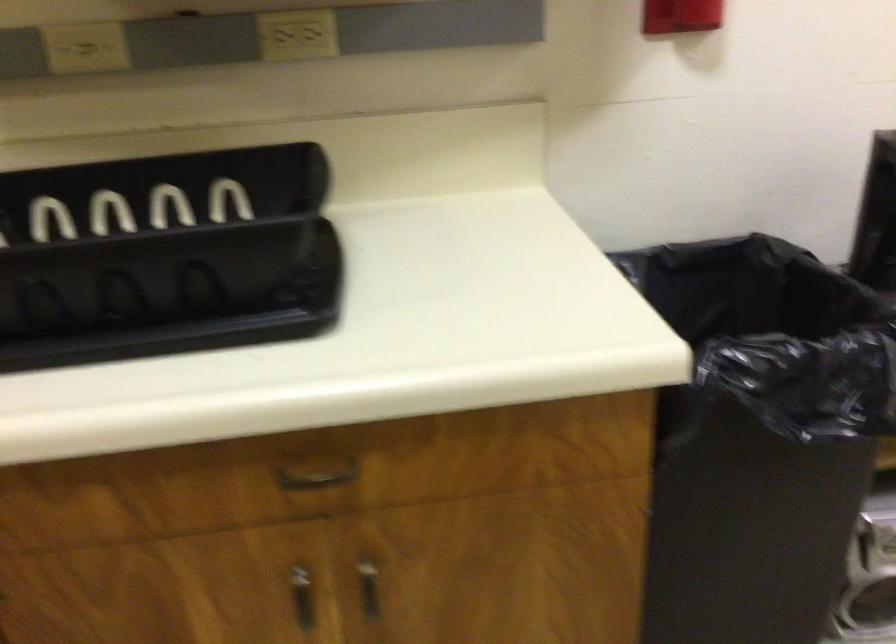
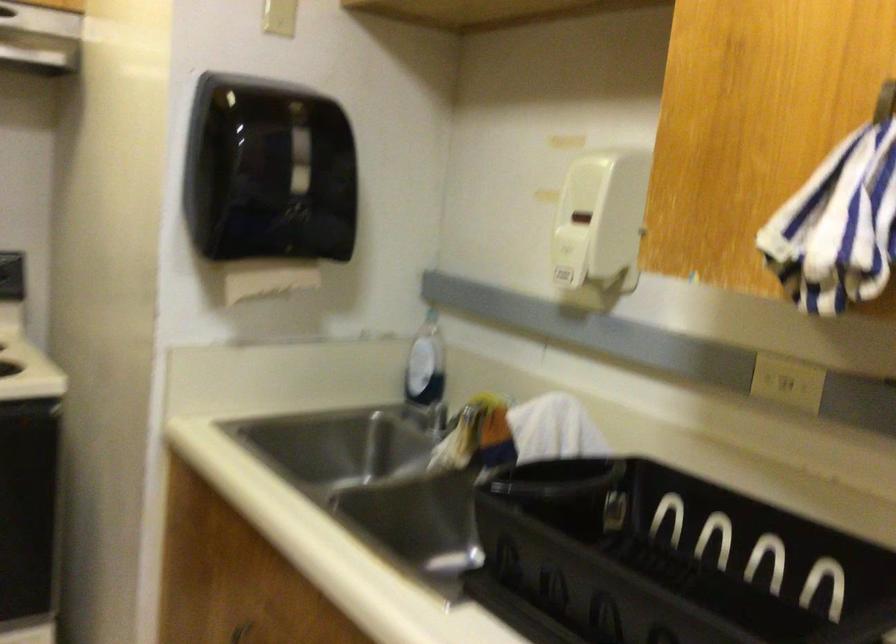
Question: The images are taken continuously from a first-person perspective. In which direction is your viewpoint rotating?

Choices:
 (A) Left
 (B) Right
 (C) Up
 (D) Down

Answer: (A)